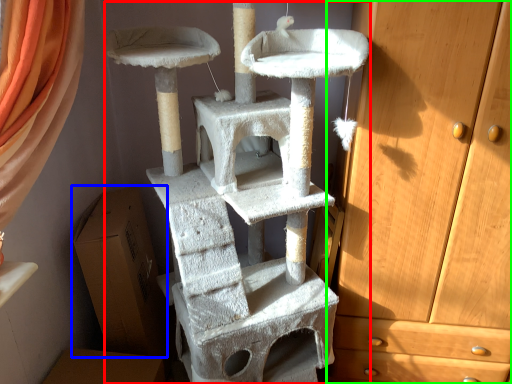
Question: Considering the real-world distances, which object is closest to bunk bed (highlighted by a red box)? cardboard box (highlighted by a blue box) or chest of drawers (highlighted by a green box).

Choices:
 (A) cardboard box
 (B) chest of drawers

Answer: (B)